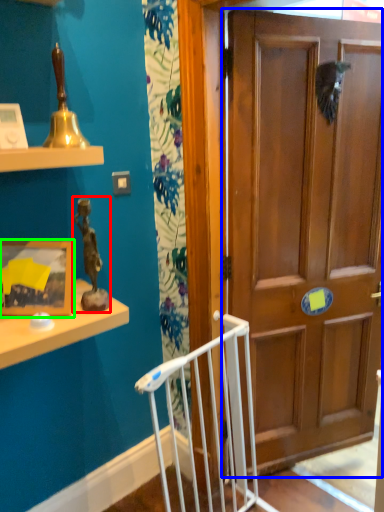
Question: Estimate the real-world distances between objects in this image. Which object is farther from toy (highlighted by a red box), door (highlighted by a blue box) or picture frame (highlighted by a green box)?

Choices:
 (A) door
 (B) picture frame

Answer: (A)